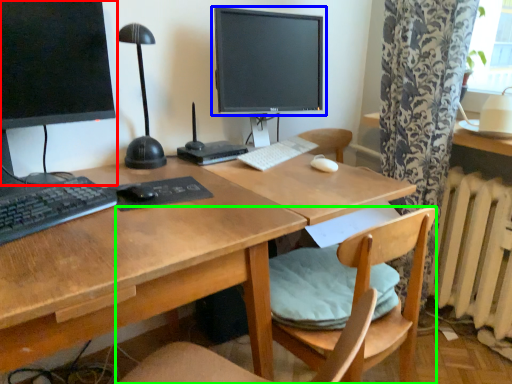
Question: Considering the real-world distances, which object is farthest from computer monitor (highlighted by a red box)? computer monitor (highlighted by a blue box) or chair (highlighted by a green box)?

Choices:
 (A) computer monitor
 (B) chair

Answer: (B)